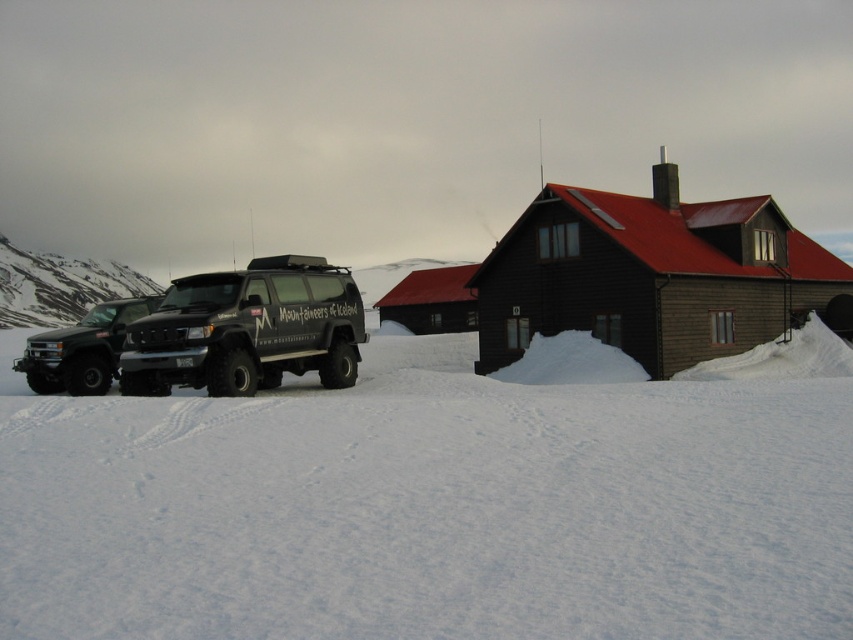
Question: Which of these objects is positioned farthest from the white powdery snow at center?

Choices:
 (A) matte black van at center
 (B) matte black truck at left

Answer: (B)

Question: Is white powdery snow at center above matte black van at center?

Choices:
 (A) yes
 (B) no

Answer: (B)

Question: Which object appears farthest from the camera in this image?

Choices:
 (A) matte black truck at left
 (B) white powdery snow at center

Answer: (A)

Question: From the image, what is the correct spatial relationship of matte black van at center in relation to matte black truck at left?

Choices:
 (A) right
 (B) left

Answer: (A)

Question: Can you confirm if matte black van at center is positioned to the right of matte black truck at left?

Choices:
 (A) no
 (B) yes

Answer: (B)

Question: Which point is closer to the camera?

Choices:
 (A) (158, 298)
 (B) (142, 324)

Answer: (B)